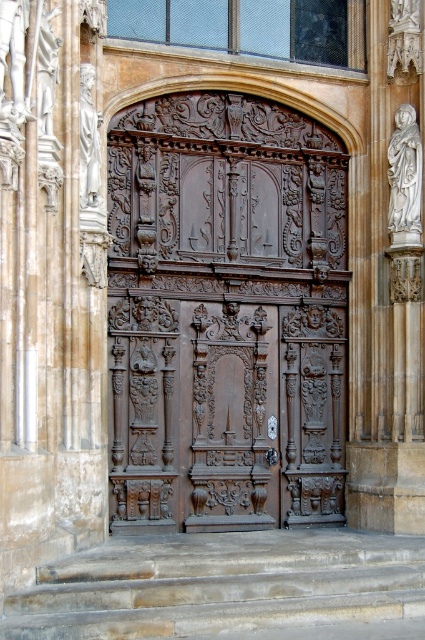
You are standing in front of the wooden door and want to move towards the point labeled as point (144,516). Which direction should you move relative to the point labeled point (308,593)?

To reach point (144,516), you should move behind point (308,593) since point (144,516) is located behind point (308,593).